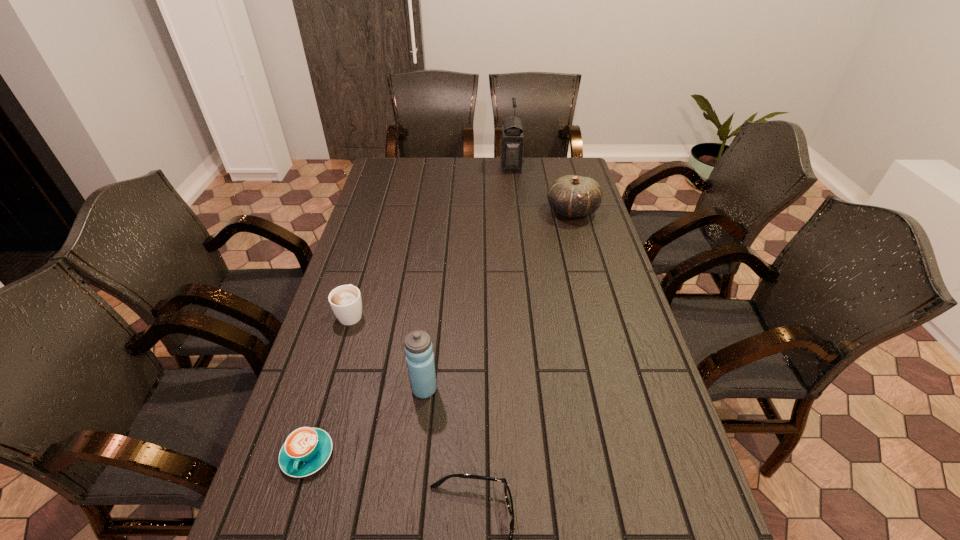
Identify the location of blank region between the fifth farthest object and the farther cappuccino. Image resolution: width=960 pixels, height=540 pixels. (329, 384).

Identify the location of free space between the fifth nearest object and the lantern. This screenshot has height=540, width=960. click(x=541, y=189).

Select which object appears as the third closest to the farther cappuccino. Please provide its 2D coordinates. Your answer should be formatted as a tuple, i.e. [(x, y)], where the tuple contains the x and y coordinates of a point satisfying the conditions above.

[(508, 496)]

At what (x,y) coordinates should I click in order to perform the action: click on object that stands as the second closest to the farther cappuccino. Please return your answer as a coordinate pair (x, y). Looking at the image, I should click on (306, 450).

Where is `free location that satisfies the following two spatial constraints: 1. on the front-facing side of the tallest object; 2. with the handle on the right side of the shorter cappuccino`? free location that satisfies the following two spatial constraints: 1. on the front-facing side of the tallest object; 2. with the handle on the right side of the shorter cappuccino is located at coordinates (542, 455).

At what (x,y) coordinates should I click in order to perform the action: click on free location that satisfies the following two spatial constraints: 1. on the front-facing side of the tallest object; 2. with the handle on the right side of the second nearest object. Please return your answer as a coordinate pair (x, y). The width and height of the screenshot is (960, 540). Looking at the image, I should click on click(542, 455).

Where is `vacant space that satisfies the following two spatial constraints: 1. on the front-facing side of the farthest object; 2. with the handle on the right side of the nearer cappuccino`? The height and width of the screenshot is (540, 960). vacant space that satisfies the following two spatial constraints: 1. on the front-facing side of the farthest object; 2. with the handle on the right side of the nearer cappuccino is located at coordinates (542, 455).